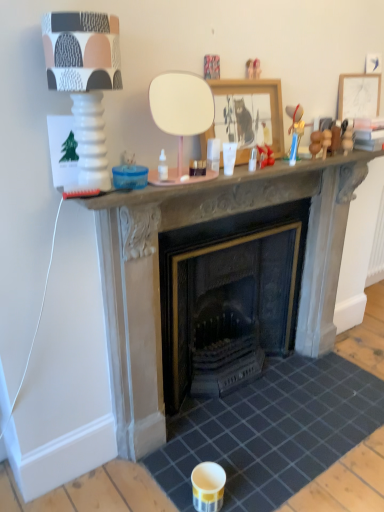
I want to click on free spot above dark gray tile at center (from a real-world perspective), so click(250, 418).